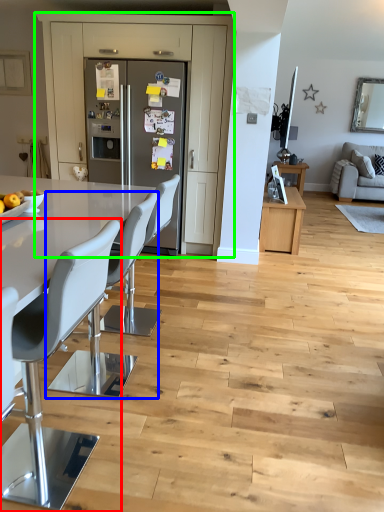
Question: Which object is the closest to the chair (highlighted by a red box)? Choose among these: chair (highlighted by a blue box) or cabinetry (highlighted by a green box).

Choices:
 (A) chair
 (B) cabinetry

Answer: (A)